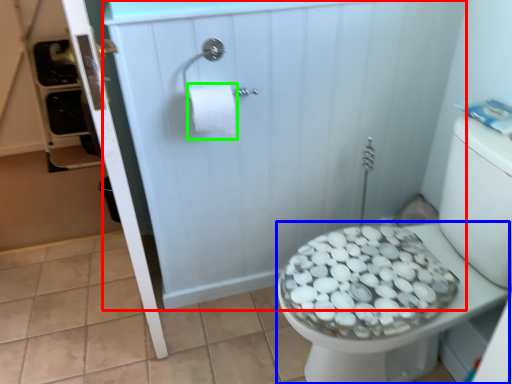
Question: Which object is positioned farthest from screen door (highlighted by a red box)? Select from bidet (highlighted by a blue box) and toilet paper (highlighted by a green box).

Choices:
 (A) bidet
 (B) toilet paper

Answer: (A)